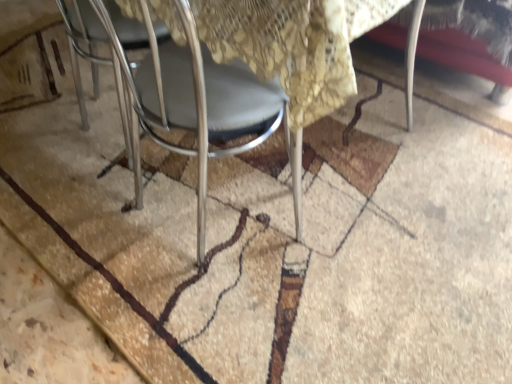
Question: From the image's perspective, is metallic gray chair at center positioned above or below brown textured mat at center?

Choices:
 (A) below
 (B) above

Answer: (A)

Question: Is point (297, 182) positioned closer to the camera than point (116, 340)?

Choices:
 (A) closer
 (B) farther

Answer: (B)

Question: Would you say metallic gray chair at center is inside or outside brown textured mat at center?

Choices:
 (A) inside
 (B) outside

Answer: (B)

Question: Considering the positions of brown textured mat at center and metallic gray chair at center in the image, is brown textured mat at center bigger or smaller than metallic gray chair at center?

Choices:
 (A) big
 (B) small

Answer: (A)

Question: In terms of width, does brown textured mat at center look wider or thinner when compared to metallic gray chair at center?

Choices:
 (A) wide
 (B) thin

Answer: (A)

Question: Is brown textured mat at center taller or shorter than metallic gray chair at center?

Choices:
 (A) tall
 (B) short

Answer: (B)

Question: Is point (130, 225) positioned closer to the camera than point (133, 87)?

Choices:
 (A) farther
 (B) closer

Answer: (A)